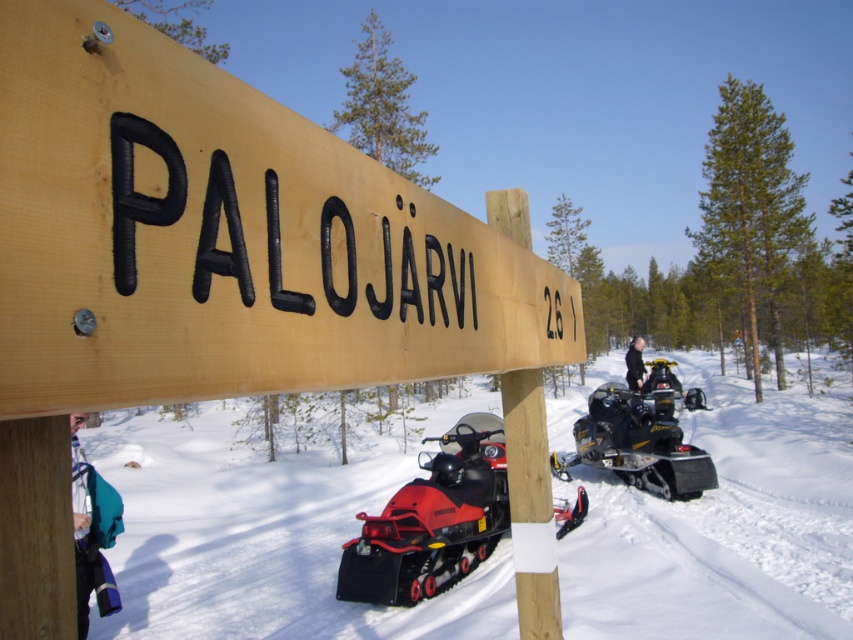
Is red matte snowmobile at center further to the viewer compared to black matte jacket at center?

No.

Is red matte snowmobile at center above black matte jacket at center?

Actually, red matte snowmobile at center is below black matte jacket at center.

Find the location of a particular element. Image resolution: width=853 pixels, height=640 pixels. red matte snowmobile at center is located at coordinates (432, 520).

Between point (254, 225) and point (172, 456), which one is positioned in front?

Point (254, 225) is in front.

Can you confirm if wooden sign at upper left is positioned to the left of white powdery snow at lower center?

Indeed, wooden sign at upper left is positioned on the left side of white powdery snow at lower center.

Between point (12, 317) and point (705, 604), which one is positioned in front?

Point (12, 317)

This screenshot has width=853, height=640. In order to click on wooden sign at upper left in this screenshot , I will do `click(225, 237)`.

Is wooden sign at upper left smaller than black rubber snowmobile at center?

Correct, wooden sign at upper left occupies less space than black rubber snowmobile at center.

Can you confirm if wooden sign at upper left is thinner than black rubber snowmobile at center?

Yes.

Is point (4, 19) behind point (596, 428)?

No, it is not.

Identify the location of wooden sign at upper left. (225, 237).